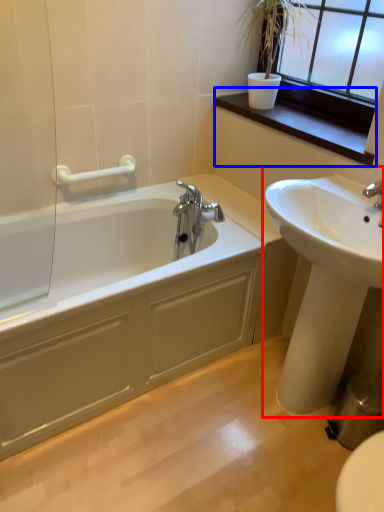
Question: Which point is further to the camera, sink (highlighted by a red box) or window sill (highlighted by a blue box)?

Choices:
 (A) sink
 (B) window sill

Answer: (B)